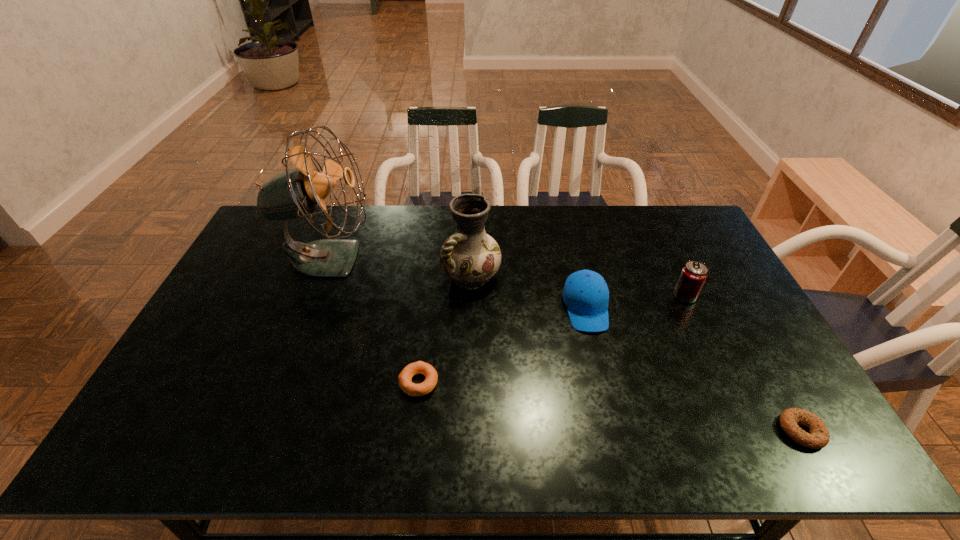
Find the location of a particular element. The height and width of the screenshot is (540, 960). pop soda situated at the right edge is located at coordinates (694, 273).

The image size is (960, 540). I want to click on bagel present at the right edge, so click(818, 438).

Where is `object that is positioned at the far left corner`? This screenshot has height=540, width=960. object that is positioned at the far left corner is located at coordinates (295, 193).

Image resolution: width=960 pixels, height=540 pixels. In order to click on object at the near right corner in this screenshot , I will do `click(818, 438)`.

In the image, there is a desktop. Where is `vacant space at the far edge`? The height and width of the screenshot is (540, 960). vacant space at the far edge is located at coordinates (499, 206).

Where is `free space at the near edge of the desktop`? The image size is (960, 540). free space at the near edge of the desktop is located at coordinates (565, 447).

You are a GUI agent. You are given a task and a screenshot of the screen. Output one action in this format:
    pyautogui.click(x=<x>, y=<y>)
    Task: Click on the vacant space at the left edge of the desktop
    The width and height of the screenshot is (960, 540).
    Given the screenshot: What is the action you would take?
    pyautogui.click(x=253, y=246)

Locate an element on the screen. This screenshot has width=960, height=540. free space at the right edge is located at coordinates (730, 313).

This screenshot has height=540, width=960. In order to click on vacant space at the far left corner in this screenshot , I will do `click(277, 243)`.

Where is `vacant space at the near left corner`? This screenshot has height=540, width=960. vacant space at the near left corner is located at coordinates (201, 424).